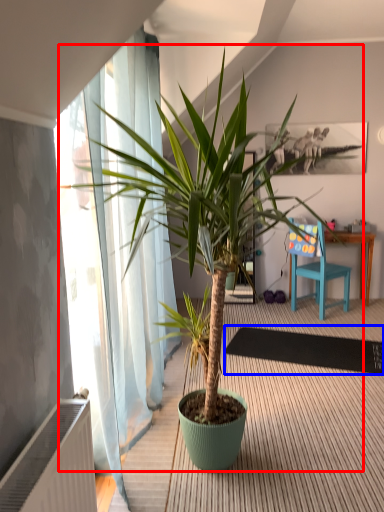
Question: Which point is further to the camera, houseplant (highlighted by a red box) or mat (highlighted by a blue box)?

Choices:
 (A) houseplant
 (B) mat

Answer: (B)